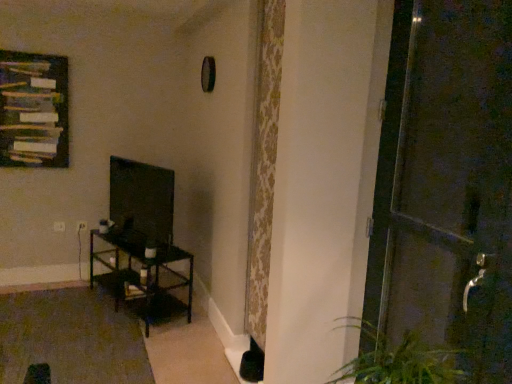
Locate an element on the screen. free point below wooden frame at upper left (from a real-world perspective) is located at coordinates (40, 282).